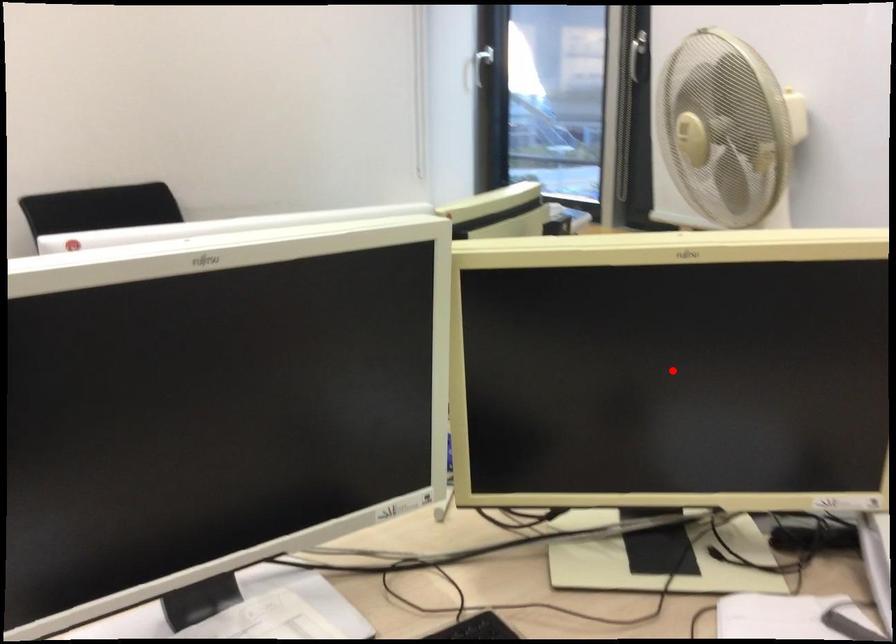
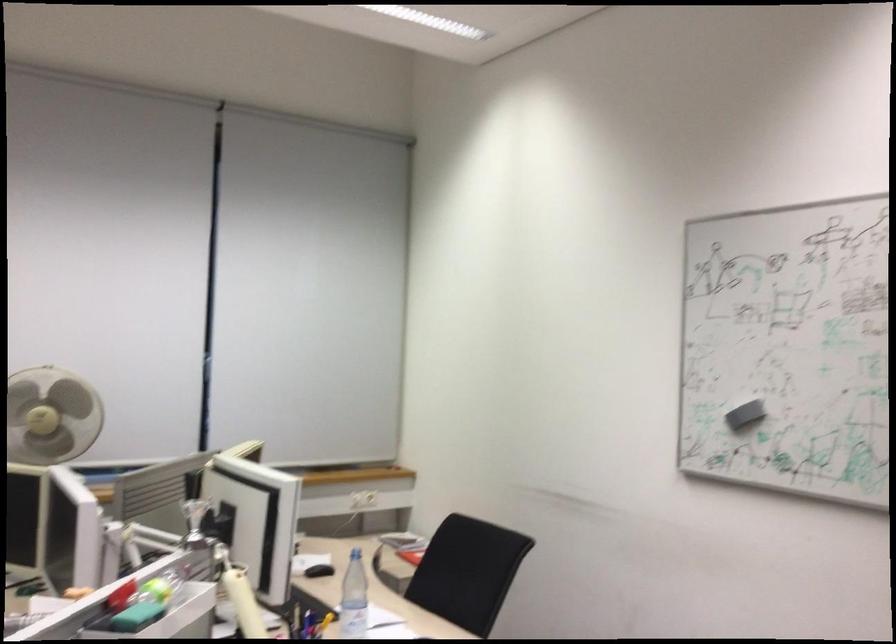
Question: I am providing you with two images of the same scene from different viewpoints. A red point is marked on the first image. Is the red point's position out of view in image 2?

Choices:
 (A) Yes
 (B) No

Answer: (A)